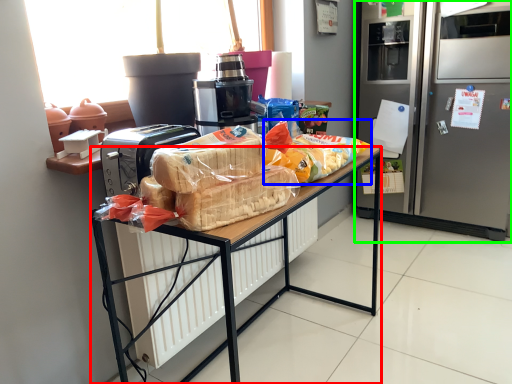
Question: Which object is positioned closest to desk (highlighted by a red box)? Select from snack (highlighted by a blue box) and refrigerator (highlighted by a green box).

Choices:
 (A) snack
 (B) refrigerator

Answer: (A)